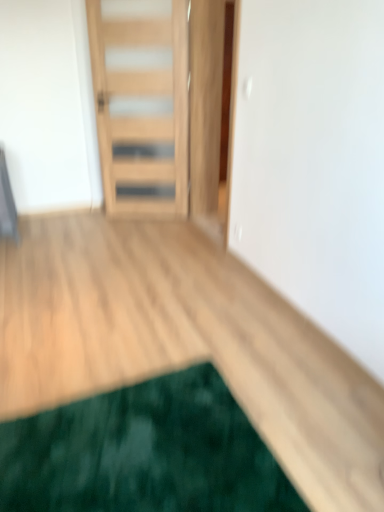
The height and width of the screenshot is (512, 384). Identify the location of vacant space behind green plush mat at lower left. (158, 333).